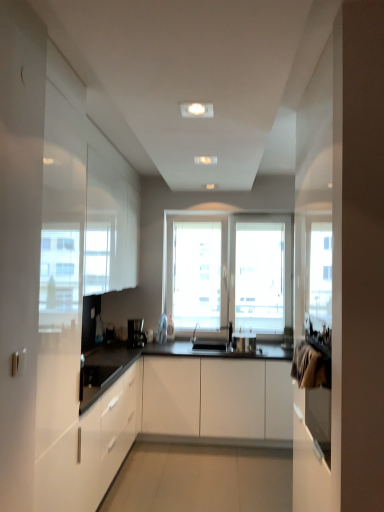
Question: Is white glossy cabinet at left, positioned as the second cabinetry in right-to-left order, shorter than white matte cabinet at center, acting as the 1th cabinetry starting from the right?

Choices:
 (A) yes
 (B) no

Answer: (A)

Question: Can you confirm if white glossy cabinet at left, which is counted as the 1th cabinetry, starting from the left, is positioned to the right of white matte cabinet at center, acting as the 1th cabinetry starting from the right?

Choices:
 (A) no
 (B) yes

Answer: (A)

Question: Is white glossy cabinet at left, positioned as the second cabinetry in right-to-left order, closer to camera compared to white matte cabinet at center, which appears as the second cabinetry when viewed from the left?

Choices:
 (A) yes
 (B) no

Answer: (A)

Question: Can we say white glossy cabinet at left, which is counted as the 1th cabinetry, starting from the left, lies outside white matte cabinet at center, acting as the 1th cabinetry starting from the right?

Choices:
 (A) yes
 (B) no

Answer: (A)

Question: Considering the relative positions of white glossy cabinet at left, which is counted as the 1th cabinetry, starting from the left, and white matte cabinet at center, acting as the 1th cabinetry starting from the right, in the image provided, is white glossy cabinet at left, which is counted as the 1th cabinetry, starting from the left, behind white matte cabinet at center, acting as the 1th cabinetry starting from the right,?

Choices:
 (A) no
 (B) yes

Answer: (A)

Question: Is white glossy cabinet at left, positioned as the second cabinetry in right-to-left order, spatially inside metallic silver pot at center, or outside of it?

Choices:
 (A) inside
 (B) outside

Answer: (B)

Question: From the image's perspective, is white glossy cabinet at left, which is counted as the 1th cabinetry, starting from the left, positioned above or below metallic silver pot at center?

Choices:
 (A) below
 (B) above

Answer: (A)

Question: Would you say white glossy cabinet at left, positioned as the second cabinetry in right-to-left order, is to the left or to the right of metallic silver pot at center in the picture?

Choices:
 (A) right
 (B) left

Answer: (B)

Question: Is white glossy cabinet at left, which is counted as the 1th cabinetry, starting from the left, taller or shorter than metallic silver pot at center?

Choices:
 (A) short
 (B) tall

Answer: (B)

Question: Choose the correct answer: Is metallic silver pot at center inside white glossy cabinet at left, positioned as the second cabinetry in right-to-left order, or outside it?

Choices:
 (A) inside
 (B) outside

Answer: (B)

Question: Considering the positions of point (243, 345) and point (72, 495), is point (243, 345) closer or farther from the camera than point (72, 495)?

Choices:
 (A) farther
 (B) closer

Answer: (A)

Question: From the image's perspective, is metallic silver pot at center located above or below white glossy cabinet at left, positioned as the second cabinetry in right-to-left order?

Choices:
 (A) above
 (B) below

Answer: (A)

Question: In terms of width, does metallic silver pot at center look wider or thinner when compared to white glossy cabinet at left, which is counted as the 1th cabinetry, starting from the left?

Choices:
 (A) wide
 (B) thin

Answer: (B)

Question: Would you say white glossy cabinet at left, positioned as the second cabinetry in right-to-left order, is inside or outside black plastic coffee machine at center?

Choices:
 (A) inside
 (B) outside

Answer: (B)

Question: Considering the positions of white glossy cabinet at left, which is counted as the 1th cabinetry, starting from the left, and black plastic coffee machine at center in the image, is white glossy cabinet at left, which is counted as the 1th cabinetry, starting from the left, taller or shorter than black plastic coffee machine at center?

Choices:
 (A) short
 (B) tall

Answer: (B)